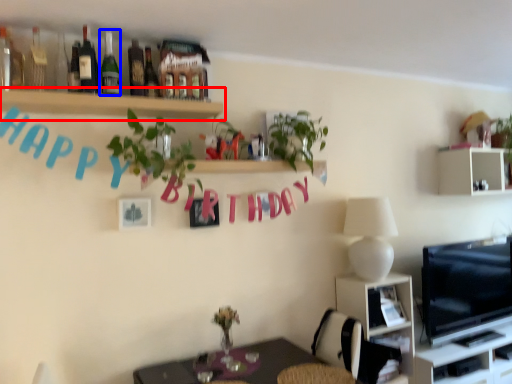
Question: Which of the following is the closest to the observer, shelf (highlighted by a red box) or bottle (highlighted by a blue box)?

Choices:
 (A) shelf
 (B) bottle

Answer: (A)